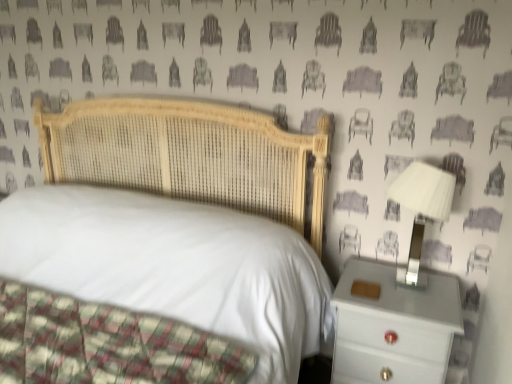
Question: From a real-world perspective, does white glossy nightstand at right sit lower than woven wood bed at center?

Choices:
 (A) yes
 (B) no

Answer: (A)

Question: From the image's perspective, is white glossy nightstand at right above woven wood bed at center?

Choices:
 (A) yes
 (B) no

Answer: (B)

Question: From the image's perspective, does white glossy nightstand at right appear lower than woven wood bed at center?

Choices:
 (A) yes
 (B) no

Answer: (A)

Question: Considering the relative positions of white glossy nightstand at right and woven wood bed at center in the image provided, is white glossy nightstand at right to the left of woven wood bed at center from the viewer's perspective?

Choices:
 (A) no
 (B) yes

Answer: (A)

Question: Does white glossy nightstand at right appear on the right side of woven wood bed at center?

Choices:
 (A) no
 (B) yes

Answer: (B)

Question: Is white glossy nightstand at right taller than woven wood bed at center?

Choices:
 (A) no
 (B) yes

Answer: (A)

Question: Is white plastic lampshade at right at the left side of woven wood bed at center?

Choices:
 (A) yes
 (B) no

Answer: (B)

Question: From the image's perspective, would you say white plastic lampshade at right is shown under woven wood bed at center?

Choices:
 (A) no
 (B) yes

Answer: (A)

Question: From a real-world perspective, does white plastic lampshade at right sit lower than woven wood bed at center?

Choices:
 (A) yes
 (B) no

Answer: (B)

Question: From a real-world perspective, is white plastic lampshade at right over woven wood bed at center?

Choices:
 (A) yes
 (B) no

Answer: (A)

Question: Can you confirm if white plastic lampshade at right is bigger than woven wood bed at center?

Choices:
 (A) yes
 (B) no

Answer: (B)

Question: From the image's perspective, is white plastic lampshade at right on top of woven wood bed at center?

Choices:
 (A) no
 (B) yes

Answer: (B)

Question: Is woven wood bed at center outside white plastic lampshade at right?

Choices:
 (A) no
 (B) yes

Answer: (B)